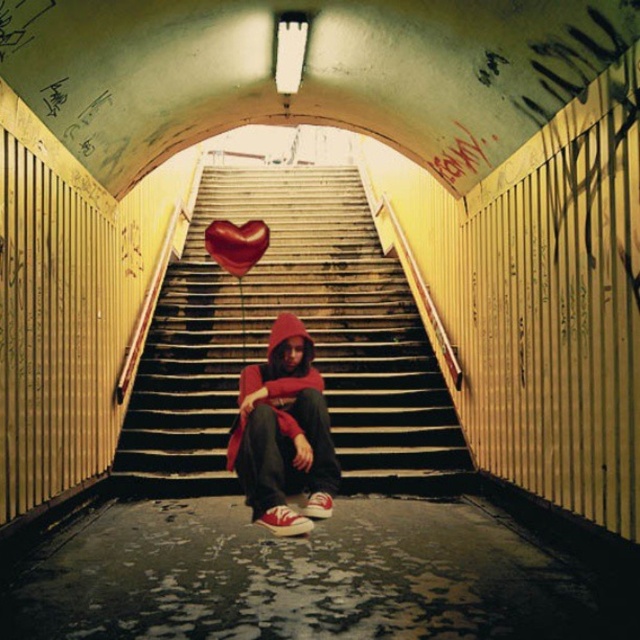
You are an urban explorer who wants to place a small, delicate item on the shiny red heart at center without accidentally placing it on the smooth concrete stairs at center. How can you ensure the item is placed correctly?

The smooth concrete stairs at center is positioned over the shiny red heart at center, so you should place the item below the stairs to ensure it lands on the shiny red heart at center instead of the stairs.

Based on the photo, you are standing at the bottom of the staircase in the underpass and notice two points marked on the wall. The first point is at coordinate point (198, 220) and the second is at point (230, 461). Which point is closer to you?

Point (198, 220) is further to the camera than point (230, 461), so the point closer to you is point (230, 461).

From the picture: You are an urban explorer who wants to take a photo of the shiny red heart at center and the red matte hoodie at center. Since the underpass has limited lighting, you need to position yourself so both objects are well lit by the fluorescent light. Which object should you place closer to the light to ensure both are properly illuminated?

The red matte hoodie at center should be placed closer to the fluorescent light because it is below the shiny red heart at center, so adjusting its position might help balance the lighting between both objects.